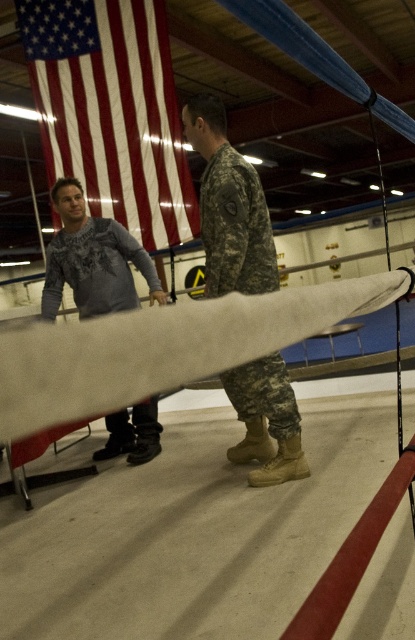
Does red-white striped flag at upper left lie behind gray sweater at left?

Yes.

Based on the photo, is red-white striped flag at upper left to the left of gray sweater at left from the viewer's perspective?

Incorrect, red-white striped flag at upper left is not on the left side of gray sweater at left.

The height and width of the screenshot is (640, 415). In order to click on red-white striped flag at upper left in this screenshot , I will do `click(112, 109)`.

Where is `red-white striped flag at upper left`? This screenshot has width=415, height=640. red-white striped flag at upper left is located at coordinates (112, 109).

What are the coordinates of `red-white striped flag at upper left` in the screenshot? It's located at (112, 109).

Is red-white striped flag at upper left above white fabric beam at center?

Yes.

Between point (41, 112) and point (310, 292), which one is positioned behind?

Positioned behind is point (41, 112).

Identify the location of red-white striped flag at upper left. (112, 109).

What do you see at coordinates (112, 109) in the screenshot? I see `red-white striped flag at upper left` at bounding box center [112, 109].

Can you confirm if red-white striped flag at upper left is taller than camouflage fabric uniform at center?

Correct, red-white striped flag at upper left is much taller as camouflage fabric uniform at center.

Which is in front, point (88, 118) or point (241, 248)?

Point (241, 248)

You are a GUI agent. You are given a task and a screenshot of the screen. Output one action in this format:
    pyautogui.click(x=<x>, y=<y>)
    Task: Click on the red-white striped flag at upper left
    
    Given the screenshot: What is the action you would take?
    pyautogui.click(x=112, y=109)